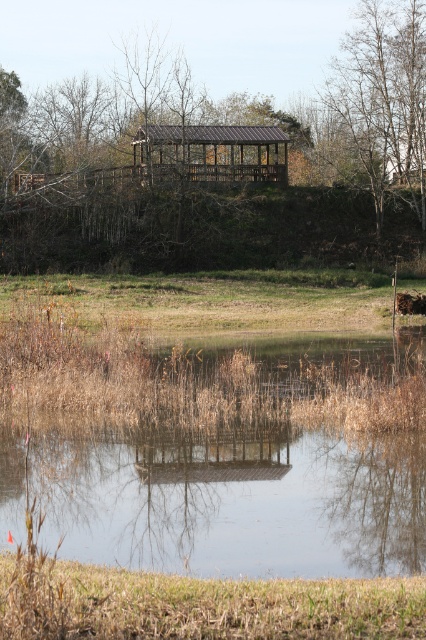
Question: From the image, what is the correct spatial relationship of green grass at center in relation to metallic brown gazebo at upper center?

Choices:
 (A) above
 (B) below

Answer: (B)

Question: Among these objects, which one is nearest to the camera?

Choices:
 (A) brown wooden gazebo at upper center
 (B) metallic brown gazebo at upper center

Answer: (A)

Question: Which point is closer to the camera taking this photo?

Choices:
 (A) (158, 157)
 (B) (339, 284)
 (C) (394, 161)

Answer: (B)

Question: Does brown wooden gazebo at upper center have a greater width compared to green grass at center?

Choices:
 (A) yes
 (B) no

Answer: (A)

Question: Is brown wooden gazebo at upper center closer to camera compared to metallic brown gazebo at upper center?

Choices:
 (A) yes
 (B) no

Answer: (A)

Question: Which object is farther from the camera taking this photo?

Choices:
 (A) brown leafy tree at upper right
 (B) brown wooden gazebo at upper center

Answer: (A)